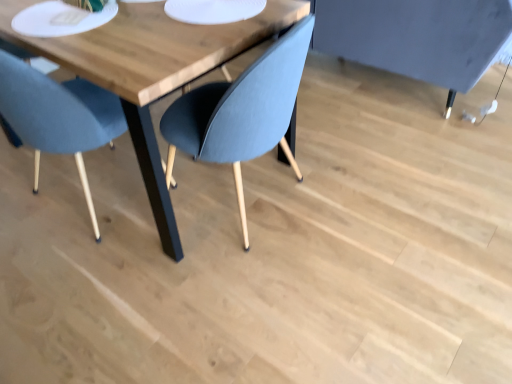
Question: Is white matte paper plate at upper center inside or outside of wooden table at center?

Choices:
 (A) inside
 (B) outside

Answer: (A)

Question: From the image's perspective, is white matte paper plate at upper center above or below wooden table at center?

Choices:
 (A) below
 (B) above

Answer: (B)

Question: Based on their relative distances, which object is farther from the matte blue chair at left?

Choices:
 (A) wooden table at center
 (B) white matte platter at upper left
 (C) white matte paper plate at upper center

Answer: (C)

Question: Which object is positioned closest to the white matte paper plate at upper center?

Choices:
 (A) wooden table at center
 (B) white matte platter at upper left
 (C) matte blue chair at left

Answer: (A)